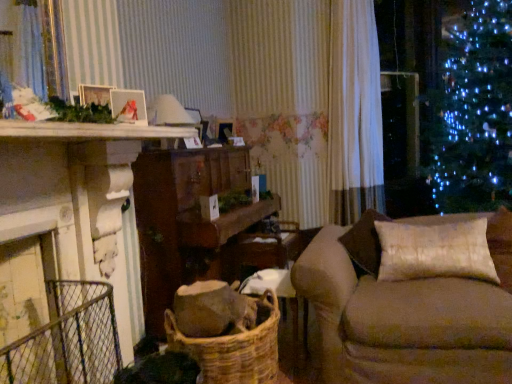
Question: Does white sheer curtain at center come behind metallic silver frame at upper left?

Choices:
 (A) yes
 (B) no

Answer: (A)

Question: Is white sheer curtain at center far from metallic silver frame at upper left?

Choices:
 (A) yes
 (B) no

Answer: (A)

Question: From a real-world perspective, is white sheer curtain at center located beneath metallic silver frame at upper left?

Choices:
 (A) yes
 (B) no

Answer: (B)

Question: Can you confirm if white sheer curtain at center is thinner than metallic silver frame at upper left?

Choices:
 (A) yes
 (B) no

Answer: (B)

Question: Does white sheer curtain at center turn towards metallic silver frame at upper left?

Choices:
 (A) yes
 (B) no

Answer: (B)

Question: Considering the positions of white wooden mantle at upper left and velvet beige couch at right in the image, is white wooden mantle at upper left taller or shorter than velvet beige couch at right?

Choices:
 (A) short
 (B) tall

Answer: (A)

Question: From the image's perspective, is white wooden mantle at upper left above or below velvet beige couch at right?

Choices:
 (A) above
 (B) below

Answer: (A)

Question: From a real-world perspective, relative to velvet beige couch at right, is white wooden mantle at upper left vertically above or below?

Choices:
 (A) below
 (B) above

Answer: (B)

Question: Considering the positions of white wooden mantle at upper left and velvet beige couch at right in the image, is white wooden mantle at upper left bigger or smaller than velvet beige couch at right?

Choices:
 (A) big
 (B) small

Answer: (B)

Question: From the image's perspective, is white wooden mantle at upper left above or below white sheer curtain at center?

Choices:
 (A) below
 (B) above

Answer: (A)

Question: Considering their positions, is white wooden mantle at upper left located in front of or behind white sheer curtain at center?

Choices:
 (A) front
 (B) behind

Answer: (A)

Question: Is point (116, 135) closer or farther from the camera than point (368, 46)?

Choices:
 (A) farther
 (B) closer

Answer: (B)

Question: In terms of width, does white wooden mantle at upper left look wider or thinner when compared to white sheer curtain at center?

Choices:
 (A) thin
 (B) wide

Answer: (B)

Question: In terms of size, does white wooden mantle at upper left appear bigger or smaller than woven brown basket at lower center?

Choices:
 (A) small
 (B) big

Answer: (A)

Question: Is white wooden mantle at upper left taller or shorter than woven brown basket at lower center?

Choices:
 (A) short
 (B) tall

Answer: (A)